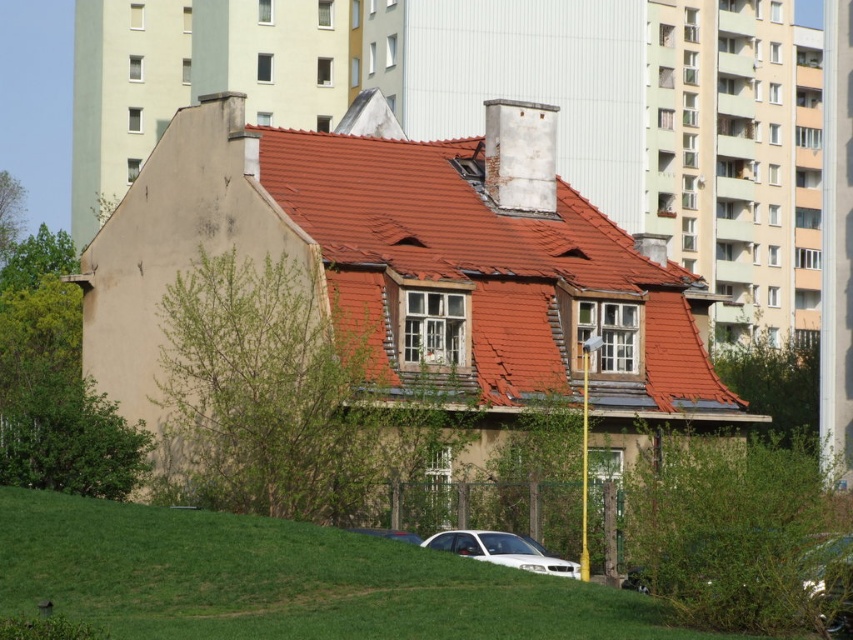
Question: Among these points, which one is nearest to the camera?

Choices:
 (A) (9, 493)
 (B) (379, 531)
 (C) (519, 557)

Answer: (C)

Question: From the image, what is the correct spatial relationship of red tile roof at center in relation to white glossy car at lower center?

Choices:
 (A) above
 (B) below

Answer: (A)

Question: In this image, where is red tile roof at center located relative to white glossy car at lower center?

Choices:
 (A) right
 (B) left

Answer: (A)

Question: Which point appears closest to the camera in this image?

Choices:
 (A) (41, 596)
 (B) (532, 554)
 (C) (381, 529)
 (D) (358, 198)

Answer: (A)

Question: Which point appears farthest from the camera in this image?

Choices:
 (A) (519, 243)
 (B) (589, 621)
 (C) (358, 528)
 (D) (459, 547)

Answer: (A)

Question: Is green grass at lower center above metallic silver car at lower center?

Choices:
 (A) no
 (B) yes

Answer: (B)